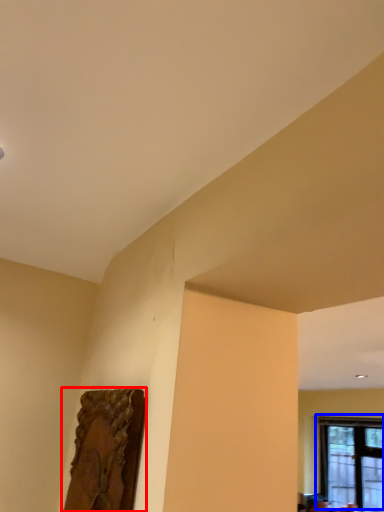
Question: Among these objects, which one is farthest to the camera, picture frame (highlighted by a red box) or window (highlighted by a blue box)?

Choices:
 (A) picture frame
 (B) window

Answer: (B)